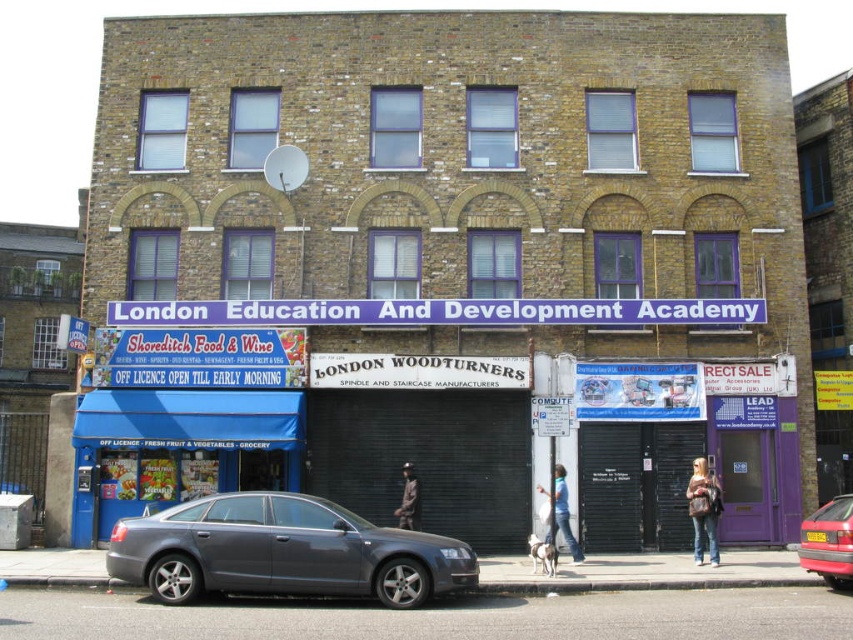
Question: Can you confirm if denim jacket at lower right is positioned above blue jeans at lower center?

Choices:
 (A) no
 (B) yes

Answer: (A)

Question: Does denim jacket at lower right have a greater width compared to blue jeans at lower center?

Choices:
 (A) yes
 (B) no

Answer: (B)

Question: Which point appears farthest from the camera in this image?

Choices:
 (A) (717, 545)
 (B) (405, 486)
 (C) (556, 522)
 (D) (331, 550)

Answer: (B)

Question: Can you confirm if denim jacket at lower right is positioned above blue jeans at lower center?

Choices:
 (A) no
 (B) yes

Answer: (A)

Question: Which is nearer to the blue jeans at lower center?

Choices:
 (A) dark brown leather jacket at center
 (B) red metallic car at center
 (C) satin silver car at center

Answer: (A)

Question: Which of the following is the closest to the observer?

Choices:
 (A) (697, 493)
 (B) (827, 540)
 (C) (546, 493)
 (D) (195, 513)

Answer: (D)